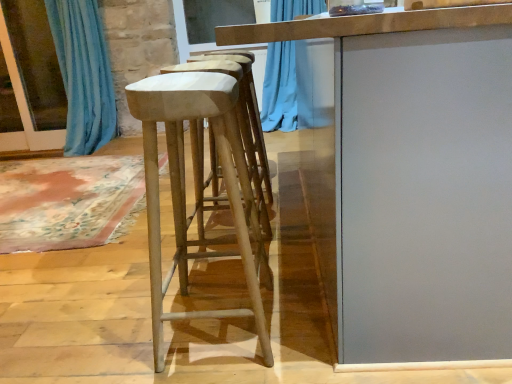
Question: Is smooth gray table at center aimed at blue fabric curtain at left?

Choices:
 (A) no
 (B) yes

Answer: (A)

Question: Does smooth gray table at center contain blue fabric curtain at left?

Choices:
 (A) no
 (B) yes

Answer: (A)

Question: Can you confirm if smooth gray table at center is shorter than blue fabric curtain at left?

Choices:
 (A) no
 (B) yes

Answer: (B)

Question: From the image's perspective, does smooth gray table at center appear higher than blue fabric curtain at left?

Choices:
 (A) yes
 (B) no

Answer: (B)

Question: Is smooth gray table at center turned away from blue fabric curtain at left?

Choices:
 (A) yes
 (B) no

Answer: (B)

Question: Does point (201, 316) appear closer or farther from the camera than point (343, 54)?

Choices:
 (A) farther
 (B) closer

Answer: (A)

Question: In terms of size, does light brown wood stool at center appear bigger or smaller than smooth gray table at center?

Choices:
 (A) big
 (B) small

Answer: (B)

Question: From the image's perspective, is light brown wood stool at center located above or below smooth gray table at center?

Choices:
 (A) below
 (B) above

Answer: (A)

Question: Considering their positions, is light brown wood stool at center located in front of or behind smooth gray table at center?

Choices:
 (A) behind
 (B) front

Answer: (A)

Question: Considering their positions, is blue fabric curtain at left located in front of or behind smooth gray table at center?

Choices:
 (A) behind
 (B) front

Answer: (A)

Question: Choose the correct answer: Is blue fabric curtain at left inside smooth gray table at center or outside it?

Choices:
 (A) outside
 (B) inside

Answer: (A)

Question: From a real-world perspective, relative to smooth gray table at center, is blue fabric curtain at left vertically above or below?

Choices:
 (A) below
 (B) above

Answer: (B)

Question: Is point (96, 109) positioned closer to the camera than point (352, 33)?

Choices:
 (A) closer
 (B) farther

Answer: (B)

Question: Which is correct: smooth gray table at center is inside blue fabric curtain at left, or outside of it?

Choices:
 (A) outside
 (B) inside

Answer: (A)

Question: Is smooth gray table at center in front of or behind blue fabric curtain at left in the image?

Choices:
 (A) behind
 (B) front

Answer: (B)